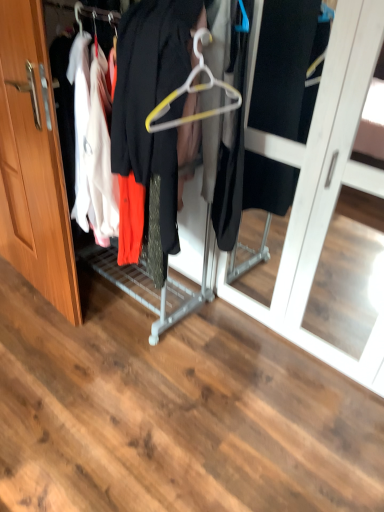
Image resolution: width=384 pixels, height=512 pixels. What do you see at coordinates (33, 164) in the screenshot? I see `metallic hanger at center` at bounding box center [33, 164].

Where is `wooden door at left`? wooden door at left is located at coordinates (33, 162).

Locate an element on the screen. The image size is (384, 512). white plastic hanger at center is located at coordinates (194, 91).

Is white plastic hanger at center located outside metallic hanger at center?

No.

Find the location of a particular element. closet that appears in front of the white plastic hanger at center is located at coordinates (33, 164).

Is there a large distance between white plastic hanger at center and metallic hanger at center?

No, there isn't a large distance between white plastic hanger at center and metallic hanger at center.

Between wooden door at left and metallic hanger at center, which one is positioned in front?

metallic hanger at center is closer to the camera.

Find the location of a particular element. This screenshot has width=384, height=512. door located on the left of metallic hanger at center is located at coordinates (33, 162).

Is the surface of wooden door at left in direct contact with metallic hanger at center?

Yes, wooden door at left is in contact with metallic hanger at center.

Based on their sizes in the image, would you say wooden door at left is bigger or smaller than metallic hanger at center?

wooden door at left is smaller than metallic hanger at center.

Is metallic hanger at center situated inside white plastic hanger at center or outside?

metallic hanger at center lies outside white plastic hanger at center.

Which is in front, point (37, 90) or point (195, 68)?

Point (195, 68)

From a real-world perspective, which object stands above the other?

In real-world perspective, white plastic hanger at center is above.

What's the angular difference between metallic hanger at center and white plastic hanger at center's facing directions?

metallic hanger at center and white plastic hanger at center are facing 1.81 degrees away from each other.

Is white plastic hanger at center in front of wooden door at left?

Yes, white plastic hanger at center is closer to the viewer.

Between white plastic hanger at center and wooden door at left, which one has more height?

wooden door at left is taller.

How far apart are white plastic hanger at center and wooden door at left?

The distance of white plastic hanger at center from wooden door at left is 31.95 inches.

From a real-world perspective, which object rests below the other?

wooden door at left.

How distant is metallic hanger at center from wooden door at left?

metallic hanger at center is 0.42 inches from wooden door at left.

Is metallic hanger at center next to wooden door at left and touching it?

Yes, metallic hanger at center is beside wooden door at left.

Could you tell me if metallic hanger at center is turned towards wooden door at left?

Yes.

Can you tell me how much metallic hanger at center and wooden door at left differ in facing direction?

3.66 degrees.

Is wooden door at left not near white plastic hanger at center?

That's not correct — wooden door at left is a little close to white plastic hanger at center.

Is wooden door at left surrounding white plastic hanger at center?

No, white plastic hanger at center is not inside wooden door at left.

Is wooden door at left closer to camera compared to white plastic hanger at center?

No, the depth of wooden door at left is greater than that of white plastic hanger at center.

Find the location of a particular element. The width and height of the screenshot is (384, 512). hanger on the right of metallic hanger at center is located at coordinates (194, 91).

Identify the location of door on the left of metallic hanger at center. (33, 162).

From the image, which object appears to be nearer to metallic hanger at center, white plastic hanger at center or wooden door at left?

The object closer to metallic hanger at center is wooden door at left.

Considering their positions, is wooden door at left positioned closer to white plastic hanger at center than metallic hanger at center?

metallic hanger at center is positioned closer to the anchor white plastic hanger at center.

Looking at the image, which one is located closer to wooden door at left, metallic hanger at center or white plastic hanger at center?

metallic hanger at center.

Based on the photo, when comparing their distances from wooden door at left, does white plastic hanger at center or metallic hanger at center seem closer?

metallic hanger at center is positioned closer to the anchor wooden door at left.

Based on their spatial positions, is wooden door at left or white plastic hanger at center closer to metallic hanger at center?

The object closer to metallic hanger at center is wooden door at left.

Based on their spatial positions, is metallic hanger at center or wooden door at left further from white plastic hanger at center?

wooden door at left.

Identify the location of closet situated between wooden door at left and white plastic hanger at center from left to right. pos(33,164).